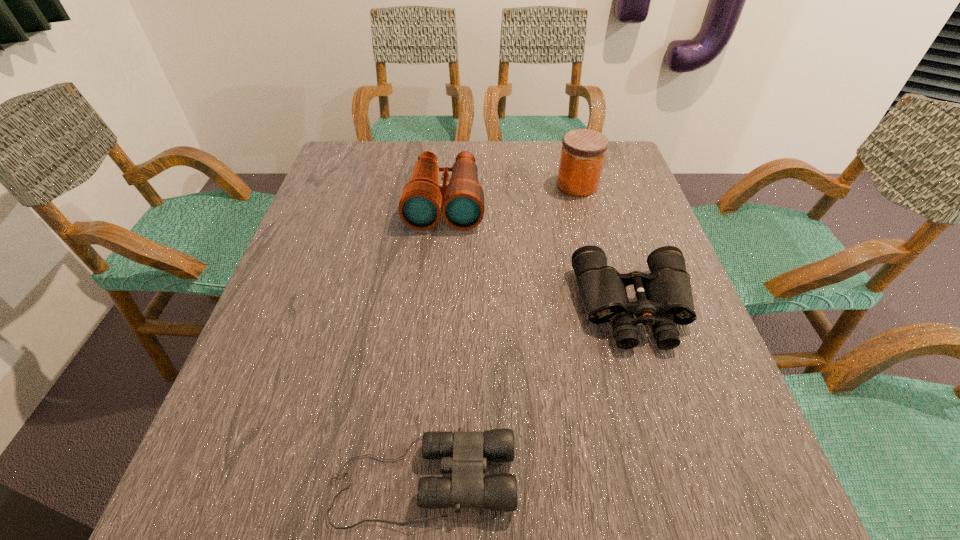
Where is `free region located 0.170m at the eyepiece of the shortest object`? This screenshot has width=960, height=540. free region located 0.170m at the eyepiece of the shortest object is located at coordinates (624, 480).

Identify the location of jar that is at the far edge. Image resolution: width=960 pixels, height=540 pixels. (583, 152).

I want to click on binoculars at the far edge, so click(462, 204).

This screenshot has height=540, width=960. Identify the location of object located in the near edge section of the desktop. point(464,453).

Identify the location of jar present at the right edge. (583, 152).

The height and width of the screenshot is (540, 960). I want to click on binoculars that is at the right edge, so click(x=664, y=297).

The width and height of the screenshot is (960, 540). Find the location of `object located in the far right corner section of the desktop`. object located in the far right corner section of the desktop is located at coordinates pyautogui.click(x=583, y=152).

At what (x,y) coordinates should I click in order to perform the action: click on free space at the far edge of the desktop. Please return your answer as a coordinate pair (x, y). Looking at the image, I should click on (495, 153).

Where is `vacant space at the left edge of the desktop`? Image resolution: width=960 pixels, height=540 pixels. vacant space at the left edge of the desktop is located at coordinates (344, 207).

Where is `free spot at the right edge of the desktop`? free spot at the right edge of the desktop is located at coordinates (696, 363).